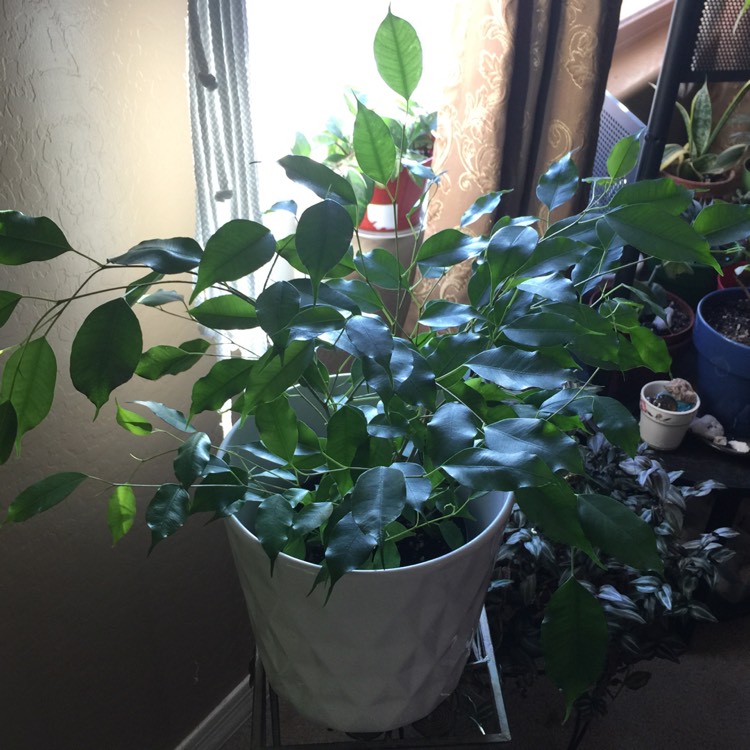
The height and width of the screenshot is (750, 750). I want to click on floor, so click(x=656, y=715).